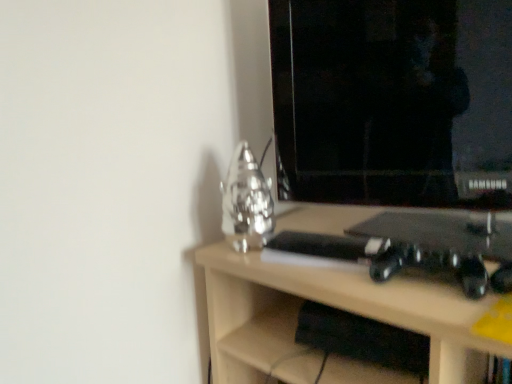
Question: Is point (367, 187) closer or farther from the camera than point (287, 312)?

Choices:
 (A) farther
 (B) closer

Answer: (A)

Question: Is black glossy monitor at upper right taller or shorter than light wood desk at center?

Choices:
 (A) short
 (B) tall

Answer: (A)

Question: Choose the correct answer: Is black glossy monitor at upper right inside light wood desk at center or outside it?

Choices:
 (A) outside
 (B) inside

Answer: (A)

Question: Considering the positions of light wood desk at center and black glossy monitor at upper right in the image, is light wood desk at center wider or thinner than black glossy monitor at upper right?

Choices:
 (A) wide
 (B) thin

Answer: (A)

Question: Based on their sizes in the image, would you say light wood desk at center is bigger or smaller than black glossy monitor at upper right?

Choices:
 (A) big
 (B) small

Answer: (A)

Question: Is light wood desk at center in front of or behind black glossy monitor at upper right in the image?

Choices:
 (A) behind
 (B) front

Answer: (B)

Question: Is light wood desk at center taller or shorter than black glossy monitor at upper right?

Choices:
 (A) tall
 (B) short

Answer: (A)